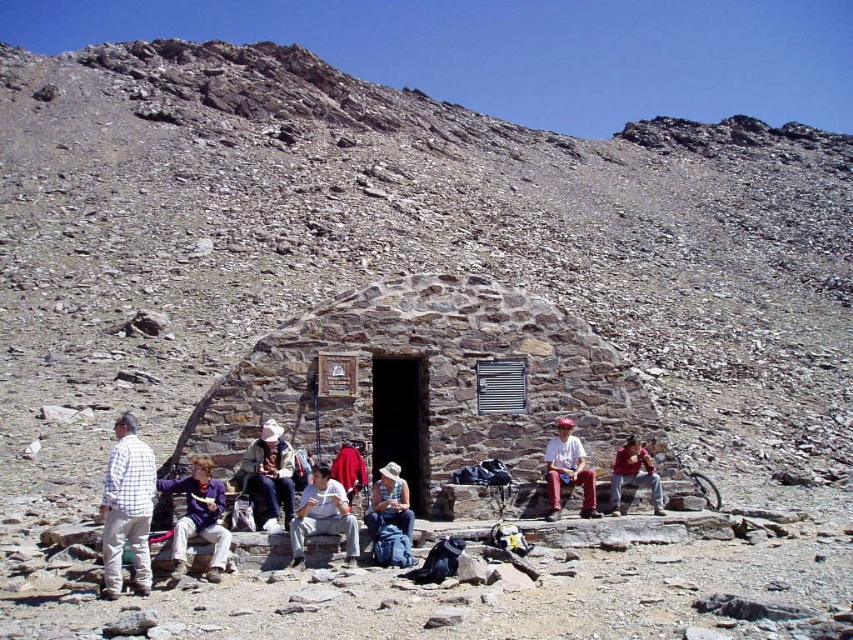
Question: Among these objects, which one is farthest from the camera?

Choices:
 (A) light blue jeans at center
 (B) khaki fabric jacket at center
 (C) matte red pants at center

Answer: (C)

Question: Is white checkered shirt at center smaller than khaki fabric jacket at center?

Choices:
 (A) no
 (B) yes

Answer: (A)

Question: Which object is the closest to the light blue jeans at center?

Choices:
 (A) white checkered shirt at center
 (B) purple fleece jacket at center

Answer: (B)

Question: Considering the relative positions of light blue jeans at center and matte red pants at center in the image provided, where is light blue jeans at center located with respect to matte red pants at center?

Choices:
 (A) right
 (B) left

Answer: (B)

Question: From the image, what is the correct spatial relationship of white checkered shirt at center in relation to denim pants at center?

Choices:
 (A) below
 (B) above

Answer: (B)

Question: Among these points, which one is nearest to the camera?

Choices:
 (A) (328, 500)
 (B) (387, 488)

Answer: (A)